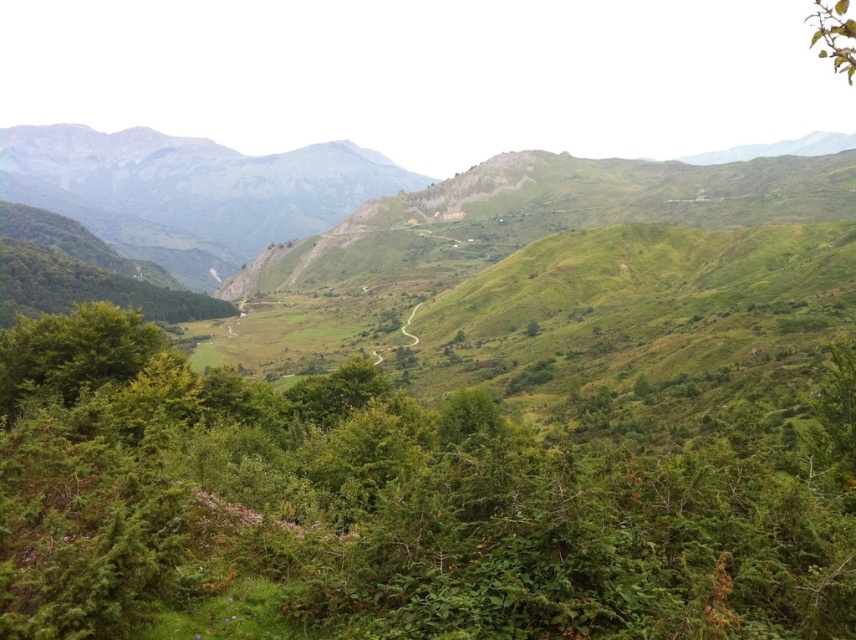
Question: Which point is closer to the camera taking this photo?

Choices:
 (A) (82, 316)
 (B) (831, 58)

Answer: (A)

Question: Is green leafy shrub at center further to the viewer compared to green leafy branch at upper right?

Choices:
 (A) yes
 (B) no

Answer: (B)

Question: Is green leafy shrub at center bigger than green leafy branch at upper right?

Choices:
 (A) yes
 (B) no

Answer: (B)

Question: Observing the image, what is the correct spatial positioning of green leafy shrub at center in reference to green leafy branch at upper right?

Choices:
 (A) left
 (B) right

Answer: (A)